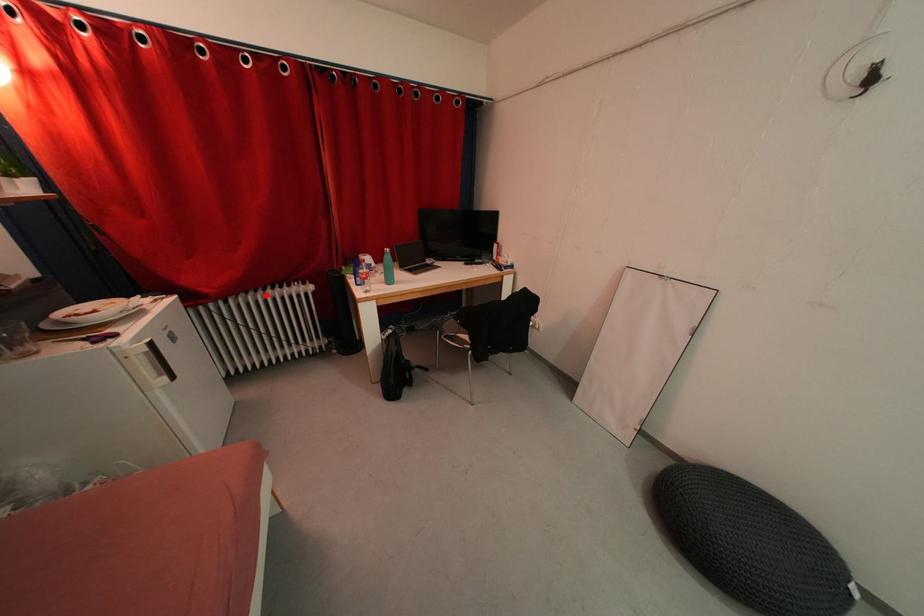
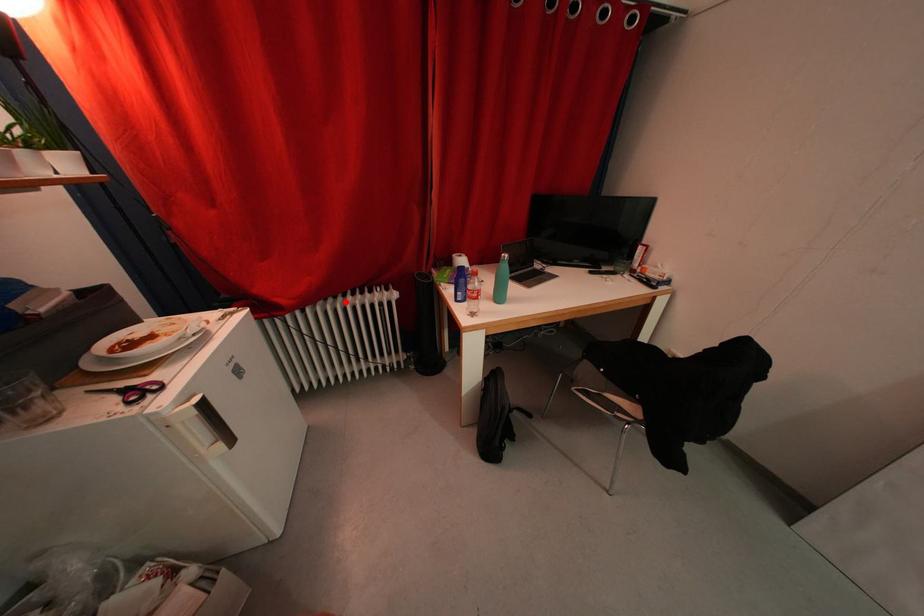
I am providing you with two images of the same scene from different viewpoints. A red point is marked on the first image and another point is marked on the second image. Is the marked point in image1 the same physical position as the marked point in image2?

Yes